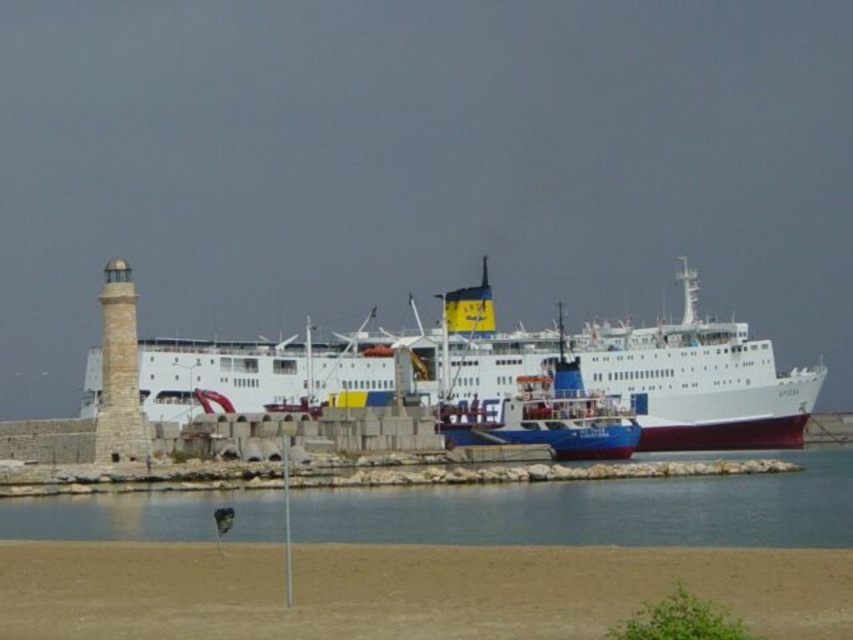
Can you confirm if white matte ship at center is positioned above blue glossy ferry at center?

Indeed, white matte ship at center is positioned over blue glossy ferry at center.

Locate an element on the screen. This screenshot has width=853, height=640. white matte ship at center is located at coordinates (339, 368).

Between point (746, 378) and point (579, 385), which one is positioned behind?

Positioned behind is point (746, 378).

Where is `white matte ship at center`? white matte ship at center is located at coordinates (339, 368).

Is brown sand at lower center smaller than white matte ship at center?

Yes.

Who is positioned more to the right, brown sand at lower center or white matte ship at center?

From the viewer's perspective, white matte ship at center appears more on the right side.

From the picture: Measure the distance between point (165, 573) and camera.

60.88 meters

Locate an element on the screen. brown sand at lower center is located at coordinates (403, 589).

Does point (647, 502) come behind point (566, 406)?

That is False.

Is clear water at lower center to the left of blue glossy ferry at center from the viewer's perspective?

No, clear water at lower center is not to the left of blue glossy ferry at center.

Find the location of a particular element. clear water at lower center is located at coordinates (602, 508).